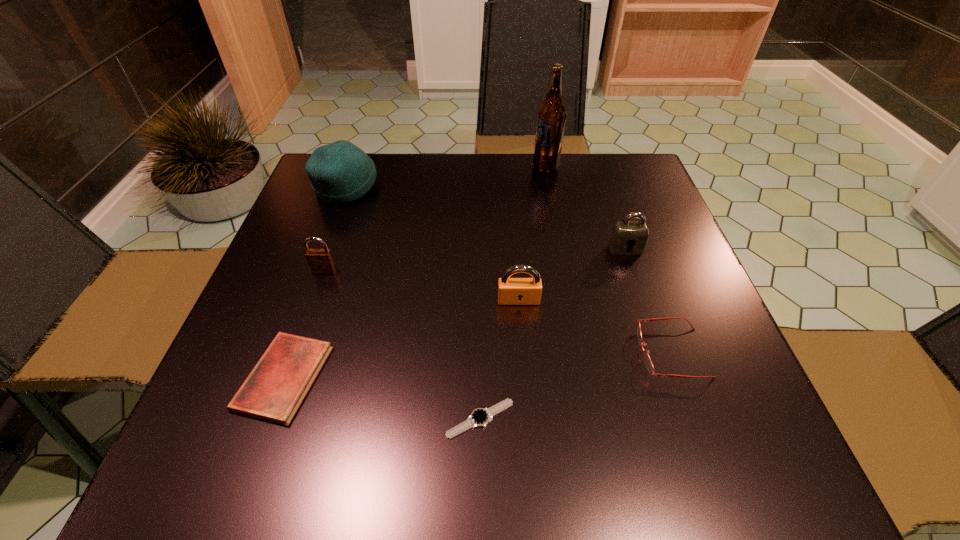
Where is `object that stands as the fifth closest to the spectacles`? The image size is (960, 540). object that stands as the fifth closest to the spectacles is located at coordinates (273, 391).

Locate an element on the screen. object that can be found as the fifth closest to the watch is located at coordinates (625, 234).

Point out which padlock is positioned as the second nearest to the shortest object. Please provide its 2D coordinates. Your answer should be formatted as a tuple, i.e. [(x, y)], where the tuple contains the x and y coordinates of a point satisfying the conditions above.

[(320, 261)]

Locate which padlock is the second closest to the second padlock from right to left. Please provide its 2D coordinates. Your answer should be formatted as a tuple, i.e. [(x, y)], where the tuple contains the x and y coordinates of a point satisfying the conditions above.

[(320, 261)]

Find the location of a particular element. This screenshot has width=960, height=540. vacant space that satisfies the following two spatial constraints: 1. on the label of the third object from right to left; 2. to unlock the nearest padlock from the front is located at coordinates (571, 300).

Identify the location of free location that satisfies the following two spatial constraints: 1. on the label of the third object from right to left; 2. to unlock the fourth nearest object from the front. This screenshot has height=540, width=960. (571, 300).